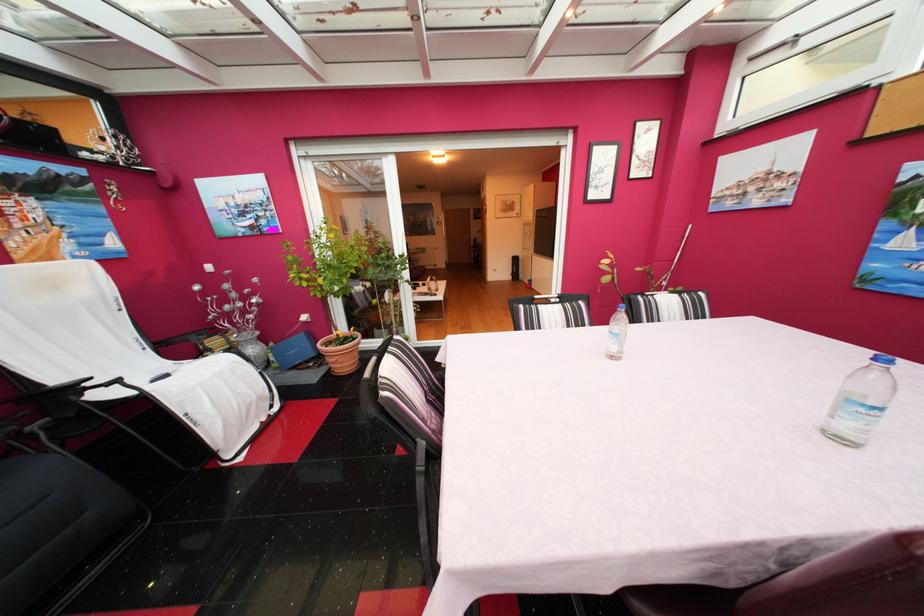
Find where to sit the white chair sitting surface. Please return your answer as a coordinate pair (x, y).

(185, 383)